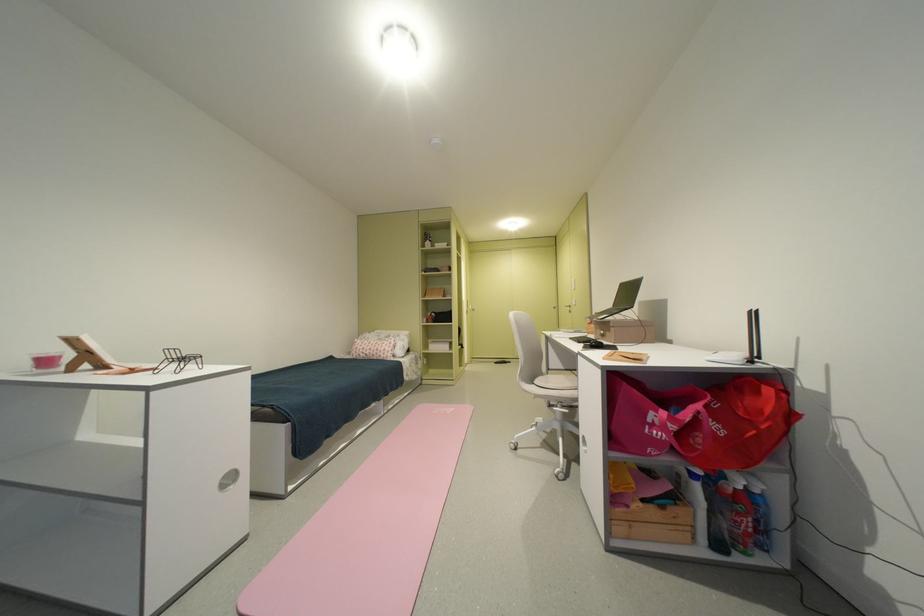
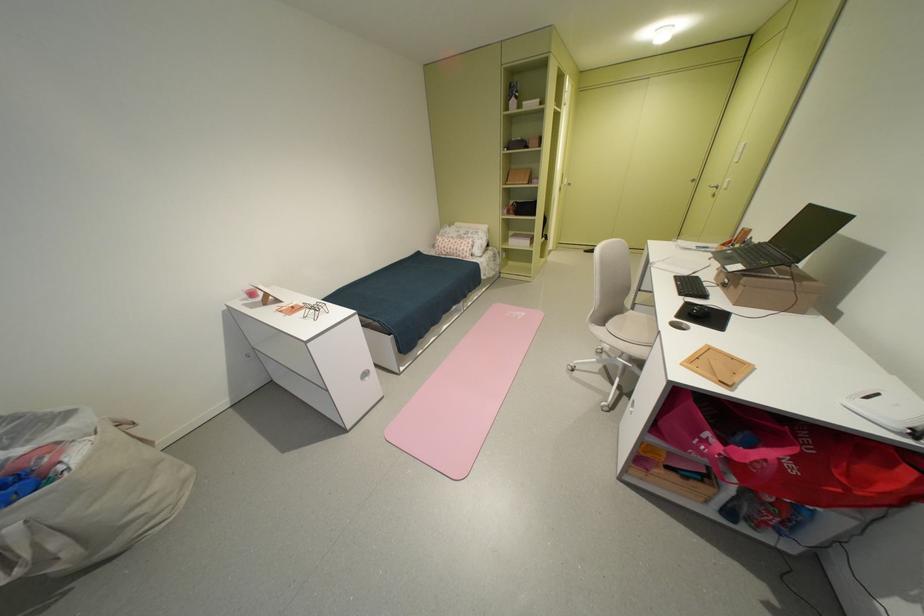
In the second image, find the point that corresponds to point (642, 355) in the first image.

(743, 360)